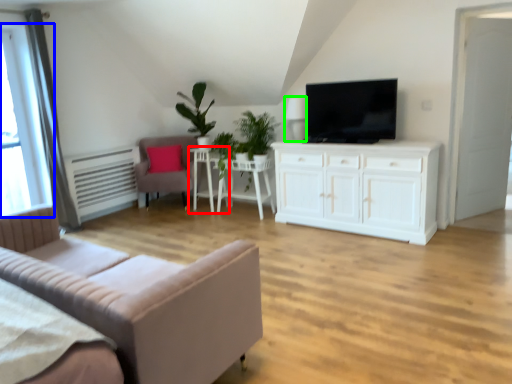
Question: Which object is positioned farthest from side table (highlighted by a red box)? Select from window (highlighted by a blue box) and lamp (highlighted by a green box).

Choices:
 (A) window
 (B) lamp

Answer: (A)